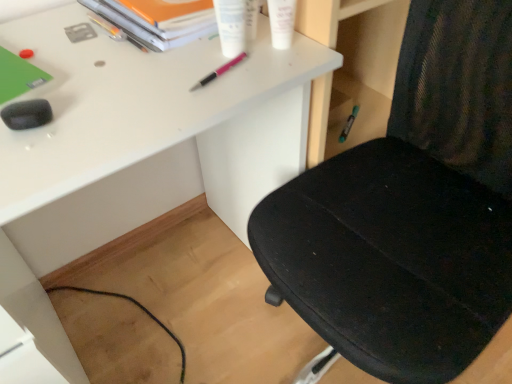
The image size is (512, 384). Find the location of `free space between orange matte paper at upper center and matte black earbuds at left, the sixth stationery positioned from the back`. free space between orange matte paper at upper center and matte black earbuds at left, the sixth stationery positioned from the back is located at coordinates (96, 58).